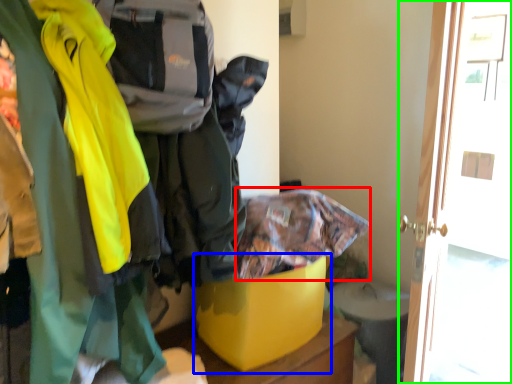
Question: Which is nearer to the cloak (highlighted by a red box)? storage box (highlighted by a blue box) or door (highlighted by a green box).

Choices:
 (A) storage box
 (B) door

Answer: (A)